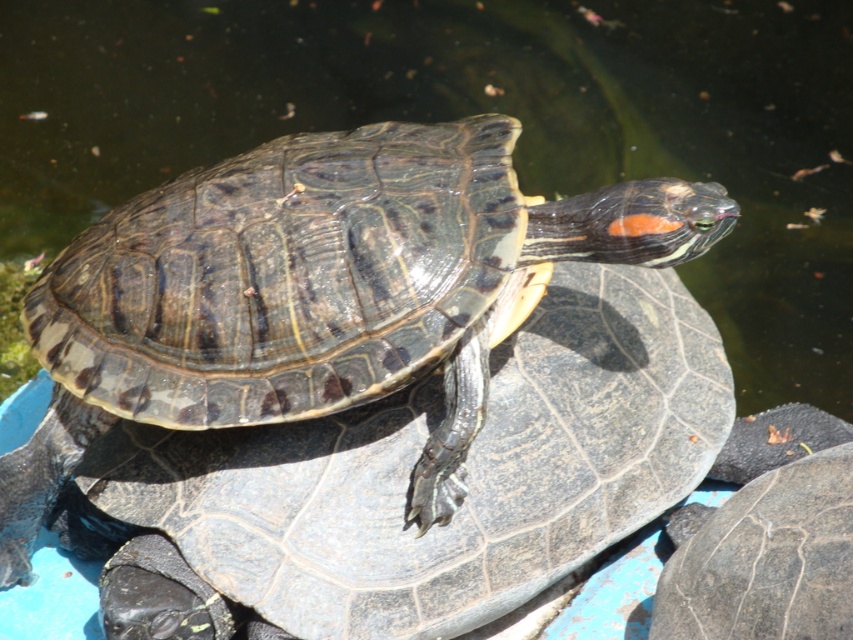
Question: Is shiny dark tortoise at center further to the viewer compared to dark gray textured shell at center?

Choices:
 (A) yes
 (B) no

Answer: (A)

Question: Does shiny dark tortoise at center have a lesser width compared to dark gray textured shell at center?

Choices:
 (A) no
 (B) yes

Answer: (A)

Question: From the image, what is the correct spatial relationship of shiny dark tortoise at center in relation to dark gray textured shell at center?

Choices:
 (A) right
 (B) left

Answer: (B)